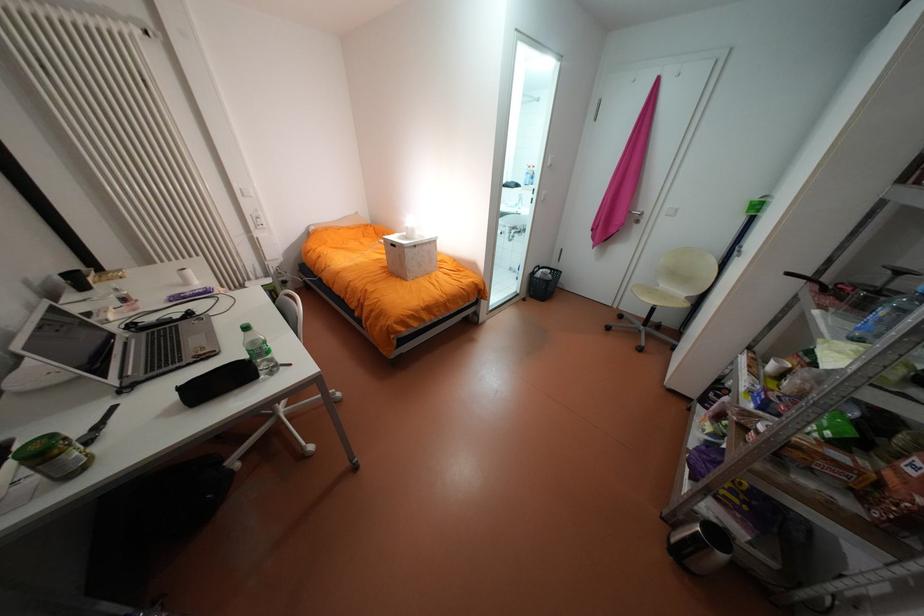
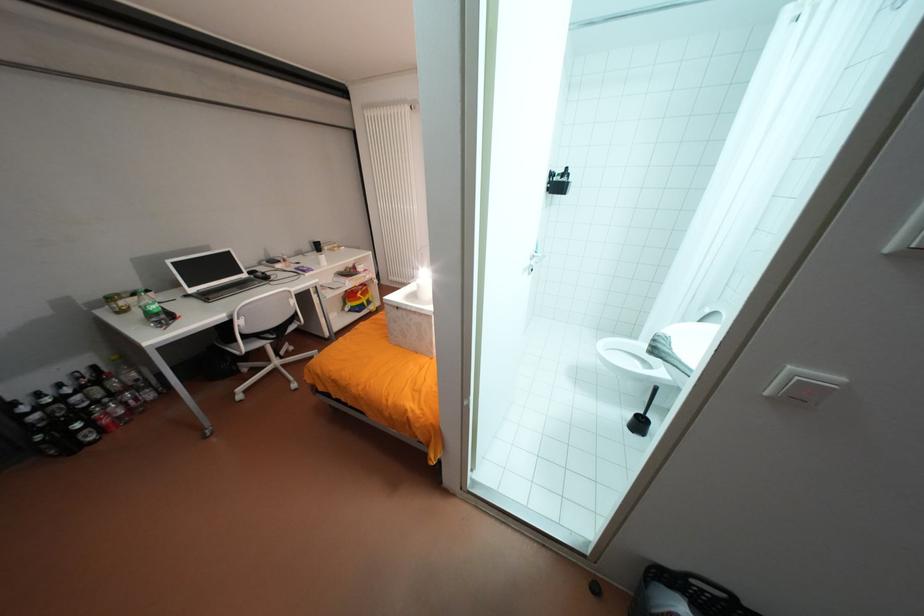
Locate, in the second image, the point that corresponds to point 551,270 in the first image.

(694, 609)